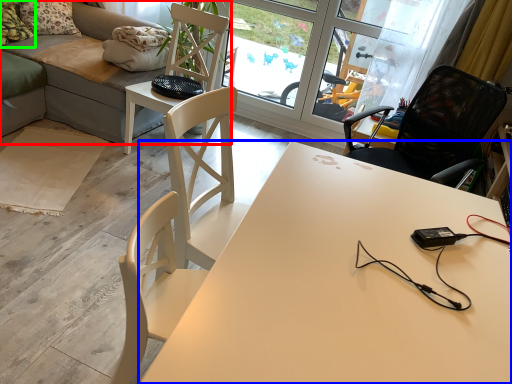
Question: Which object is the closest to the studio couch (highlighted by a red box)? Choose among these: desk (highlighted by a blue box) or pillow (highlighted by a green box).

Choices:
 (A) desk
 (B) pillow

Answer: (B)